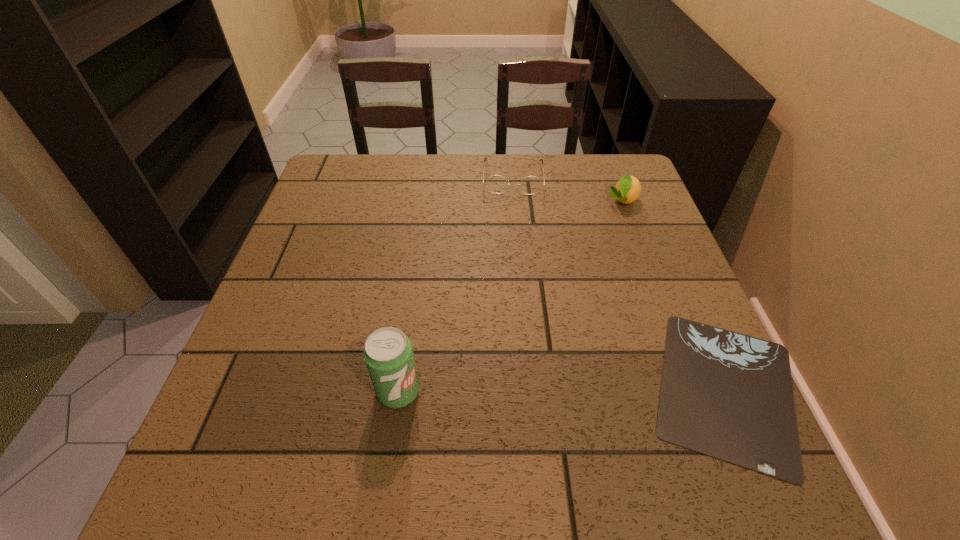
I want to click on vacant spot on the desktop that is between the leftmost object and the mousepad and is positioned with leaves positioned above the lemon, so coord(553,390).

Locate an element on the screen. This screenshot has width=960, height=540. vacant spot on the desktop that is between the soda and the shortest object and is positioned on the front-facing side of the third tallest object is located at coordinates (514, 390).